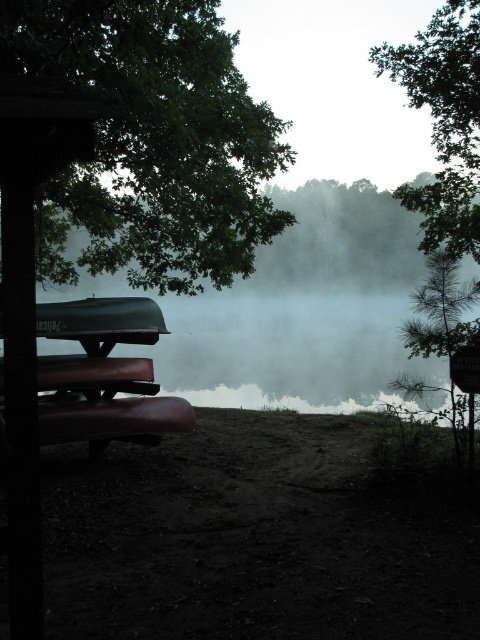
Question: Which point is closer to the camera?

Choices:
 (A) green leafy tree at upper right
 (B) green leafy tree at upper left

Answer: (B)

Question: Is the position of green leafy tree at upper left more distant than that of green leafy tree at upper right?

Choices:
 (A) no
 (B) yes

Answer: (A)

Question: Is green leafy tree at upper left above green leafy tree at upper right?

Choices:
 (A) no
 (B) yes

Answer: (B)

Question: Which point is closer to the camera taking this photo?

Choices:
 (A) (440, 58)
 (B) (118, 252)

Answer: (A)

Question: Is green leafy tree at upper left to the left of green leafy tree at upper right from the viewer's perspective?

Choices:
 (A) yes
 (B) no

Answer: (A)